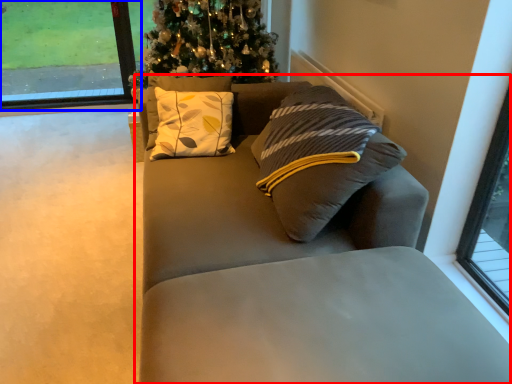
Question: Which object appears closest to the camera in this image, studio couch (highlighted by a red box) or window (highlighted by a blue box)?

Choices:
 (A) studio couch
 (B) window

Answer: (A)